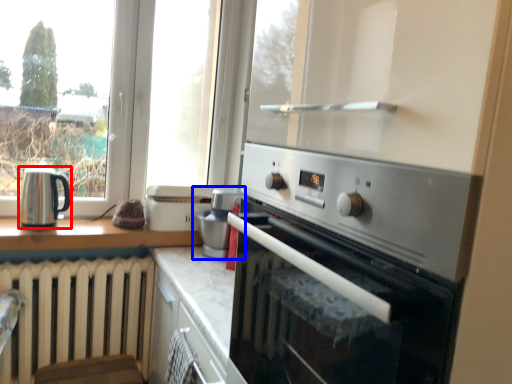
Question: Which object appears closest to the camera in this image, kitchen appliance (highlighted by a red box) or appliance (highlighted by a blue box)?

Choices:
 (A) kitchen appliance
 (B) appliance

Answer: (A)